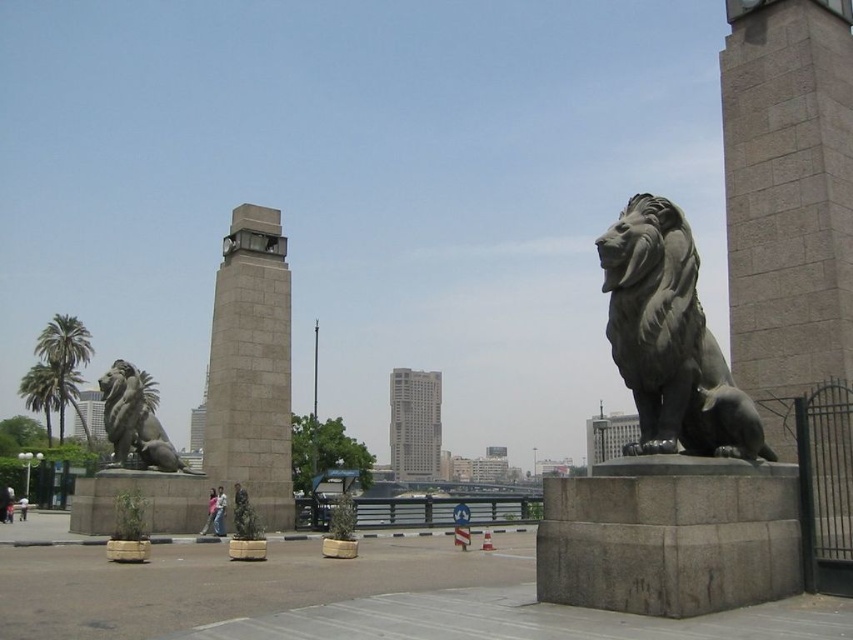
Does point (236, 288) lie in front of point (115, 420)?

That is False.

Can you confirm if gray stone clock tower at center is shorter than bronze lion at left?

No.

The image size is (853, 640). What do you see at coordinates (251, 365) in the screenshot?
I see `gray stone clock tower at center` at bounding box center [251, 365].

At what (x,y) coordinates should I click in order to perform the action: click on gray stone clock tower at center. Please return your answer as a coordinate pair (x, y). This screenshot has height=640, width=853. Looking at the image, I should click on (251, 365).

Can you confirm if bronze lion at right is positioned above gray concrete skyscraper at center?

Correct, bronze lion at right is located above gray concrete skyscraper at center.

Which is more to the left, bronze lion at right or gray concrete skyscraper at center?

gray concrete skyscraper at center is more to the left.

Identify the location of bronze lion at right. This screenshot has height=640, width=853. (670, 339).

Which is more to the left, bronze lion at right or bronze lion at left?

From the viewer's perspective, bronze lion at left appears more on the left side.

Is bronze lion at right above bronze lion at left?

Answer: Yes.

What are the coordinates of `bronze lion at right` in the screenshot? It's located at (670, 339).